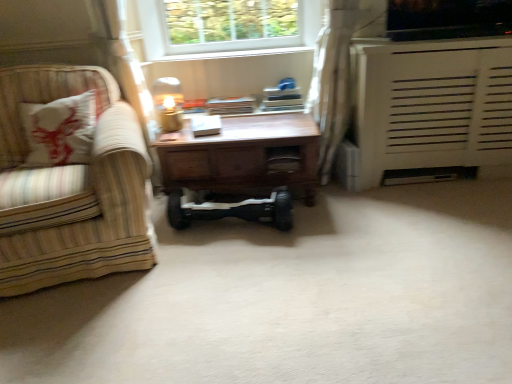
Question: Is white matte radiator at right positioned far away from wooden desk at center?

Choices:
 (A) yes
 (B) no

Answer: (B)

Question: From a real-world perspective, is white matte radiator at right located higher than wooden desk at center?

Choices:
 (A) yes
 (B) no

Answer: (A)

Question: Does white matte radiator at right have a larger size compared to wooden desk at center?

Choices:
 (A) no
 (B) yes

Answer: (B)

Question: Considering the relative sizes of white matte radiator at right and wooden desk at center in the image provided, is white matte radiator at right thinner than wooden desk at center?

Choices:
 (A) no
 (B) yes

Answer: (A)

Question: Can wooden desk at center be found inside white matte radiator at right?

Choices:
 (A) no
 (B) yes

Answer: (A)

Question: Does white matte radiator at right appear on the right side of wooden desk at center?

Choices:
 (A) no
 (B) yes

Answer: (B)

Question: From the image's perspective, is wooden drawer at center under striped fabric armchair at left?

Choices:
 (A) yes
 (B) no

Answer: (B)

Question: Can you confirm if wooden drawer at center is bigger than striped fabric armchair at left?

Choices:
 (A) no
 (B) yes

Answer: (A)

Question: Could striped fabric armchair at left be considered to be inside wooden drawer at center?

Choices:
 (A) yes
 (B) no

Answer: (B)

Question: Is wooden drawer at center wider than striped fabric armchair at left?

Choices:
 (A) no
 (B) yes

Answer: (A)

Question: Is wooden drawer at center facing away from striped fabric armchair at left?

Choices:
 (A) no
 (B) yes

Answer: (A)

Question: Is wooden drawer at center directly adjacent to striped fabric armchair at left?

Choices:
 (A) no
 (B) yes

Answer: (A)

Question: Does matte gold table lamp at center have a lesser height compared to white matte radiator at right?

Choices:
 (A) yes
 (B) no

Answer: (A)